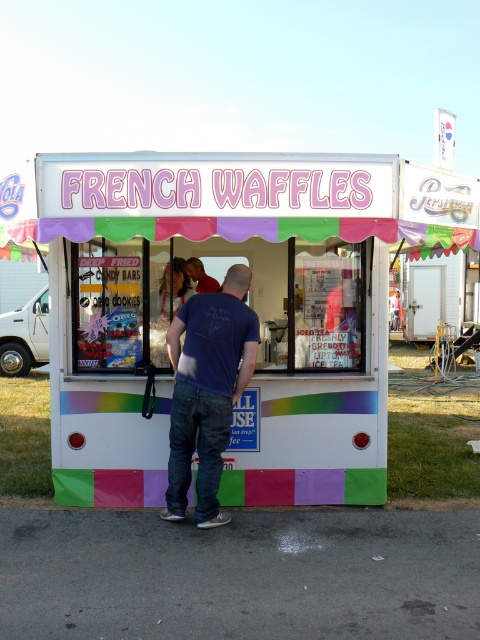
Question: Is pastel painted food truck at center below blue cotton t-shirt at center?

Choices:
 (A) yes
 (B) no

Answer: (B)

Question: From the image, what is the correct spatial relationship of blue cotton t-shirt at center in relation to blonde hair at center?

Choices:
 (A) above
 (B) below

Answer: (B)

Question: Which point is closer to the camera?

Choices:
 (A) (148, 294)
 (B) (163, 316)
 (C) (196, 273)

Answer: (A)

Question: Which of the following is the farthest from the observer?

Choices:
 (A) blue denim jeans at center
 (B) blue cotton t-shirt at center
 (C) pastel painted food truck at center
 (D) blonde hair at center

Answer: (A)

Question: From the image, what is the correct spatial relationship of blue cotton t-shirt at center in relation to blue denim jeans at center?

Choices:
 (A) below
 (B) above

Answer: (A)

Question: Among these points, which one is farthest from the camera?

Choices:
 (A) (179, 502)
 (B) (166, 301)
 (C) (73, 157)

Answer: (B)